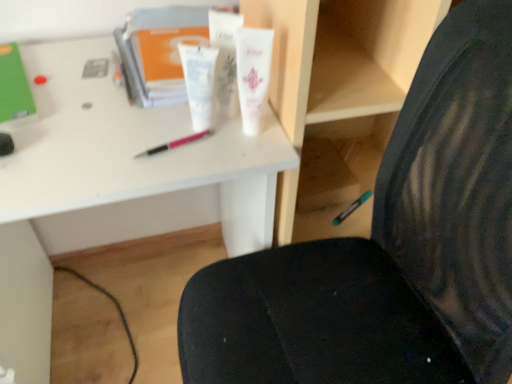
Question: Is point (239, 36) closer or farther from the camera than point (20, 67)?

Choices:
 (A) farther
 (B) closer

Answer: (B)

Question: Looking at their shapes, would you say white matte tube at center, the third toiletry viewed from the left, is wider or thinner than green matte folder at upper left, arranged as the 2th stationery when ordered from the bottom?

Choices:
 (A) thin
 (B) wide

Answer: (A)

Question: Which object is the closest to the pink plastic pen at center?

Choices:
 (A) white glossy tube at center, positioned as the 3th toiletry in right-to-left order
 (B) green matte folder at upper left, which is the second stationery from right to left
 (C) green matte marker at lower right, which is the second stationery in left-to-right order
 (D) black mesh chair at center
 (E) white plastic desk at center

Answer: (A)

Question: Estimate the real-world distances between objects in this image. Which object is closer to the green matte marker at lower right, which is counted as the first stationery, starting from the back?

Choices:
 (A) white glossy tube at center, positioned as the 3th toiletry in right-to-left order
 (B) white glossy lotion at center, the 2th toiletry from the right
 (C) white matte tube at center, positioned as the first toiletry in right-to-left order
 (D) green matte folder at upper left, the 1th stationery from the left
 (E) white plastic book at upper center

Answer: (C)